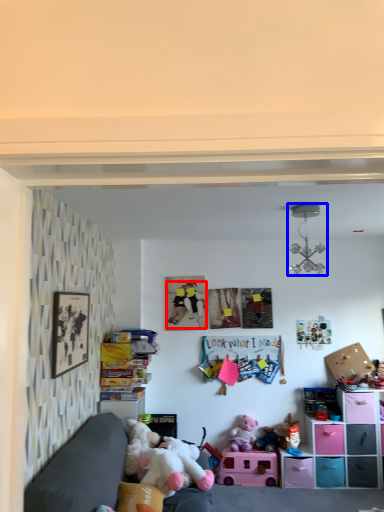
Question: Which of the following is the farthest to the observer, person (highlighted by a red box) or toy (highlighted by a blue box)?

Choices:
 (A) person
 (B) toy

Answer: (A)